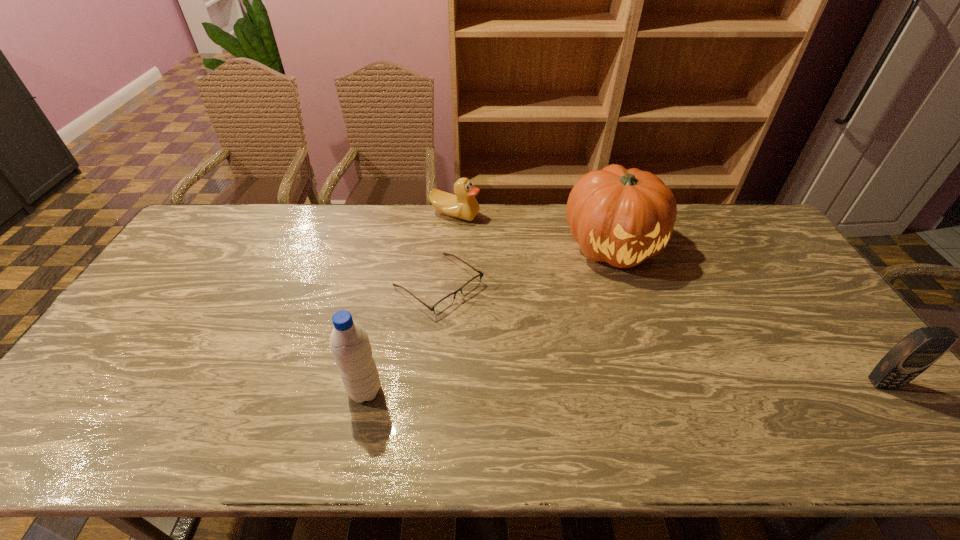
Identify the location of object that is at the right edge. The image size is (960, 540). (915, 353).

This screenshot has height=540, width=960. I want to click on object that is at the near right corner, so click(x=915, y=353).

Find the location of a particular element. This screenshot has height=540, width=960. free space at the far edge of the desktop is located at coordinates (358, 221).

At what (x,y) coordinates should I click in order to perform the action: click on free space at the near edge. Please return your answer as a coordinate pair (x, y). The image size is (960, 540). Looking at the image, I should click on (611, 389).

You are a GUI agent. You are given a task and a screenshot of the screen. Output one action in this format:
    pyautogui.click(x=<x>, y=<y>)
    Task: Click on the free space at the left edge
    The height and width of the screenshot is (540, 960).
    Given the screenshot: What is the action you would take?
    pyautogui.click(x=190, y=279)

Where is `free space at the right edge of the desktop`? This screenshot has width=960, height=540. free space at the right edge of the desktop is located at coordinates (838, 342).

You are a GUI agent. You are given a task and a screenshot of the screen. Output one action in this format:
    pyautogui.click(x=<x>, y=<y>)
    Task: Click on the free spot at the far left corner of the desktop
    
    Given the screenshot: What is the action you would take?
    pyautogui.click(x=227, y=204)

Locate an element on the screen. vacant space at the near left corner is located at coordinates (75, 390).

You are a GUI agent. You are given a task and a screenshot of the screen. Output one action in this format:
    pyautogui.click(x=<x>, y=<y>)
    Task: Click on the free area in between the second object from right to left and the duck
    
    Given the screenshot: What is the action you would take?
    pyautogui.click(x=534, y=231)

This screenshot has height=540, width=960. I want to click on free space that is in between the pumpkin and the shortest object, so click(x=525, y=266).